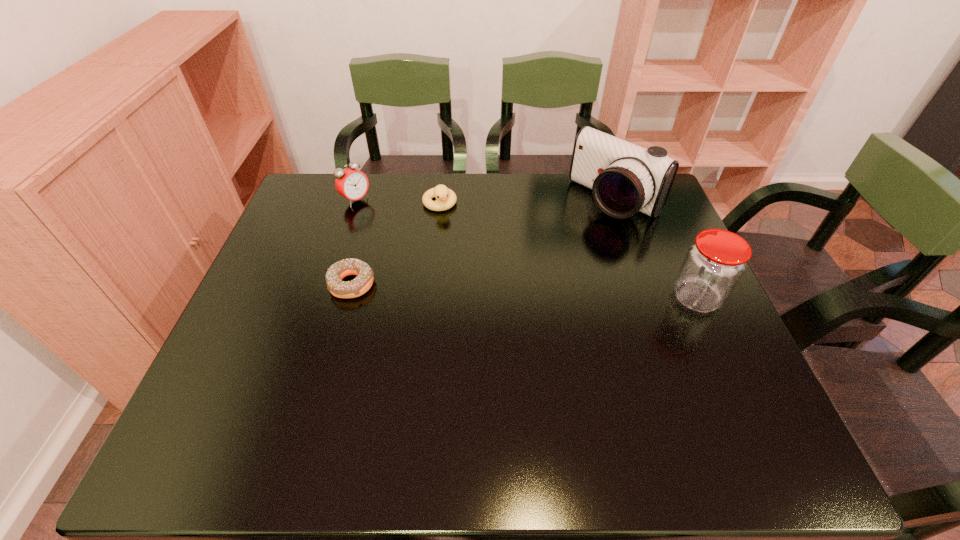
You are a GUI agent. You are given a task and a screenshot of the screen. Output one action in this format:
    pyautogui.click(x=<x>, y=<y>)
    Task: Click on the vacant space that is in between the camcorder and the third object from left to right
    The image size is (960, 540).
    Given the screenshot: What is the action you would take?
    pyautogui.click(x=527, y=202)

You are a GUI agent. You are given a task and a screenshot of the screen. Output one action in this format:
    pyautogui.click(x=<x>, y=<y>)
    Task: Click on the free space that is in between the shortest object and the camcorder
    The image size is (960, 540).
    Given the screenshot: What is the action you would take?
    pyautogui.click(x=483, y=242)

Identify the location of free area in between the shortest object and the jar. Image resolution: width=960 pixels, height=540 pixels. (524, 291).

This screenshot has height=540, width=960. I want to click on empty space that is in between the camcorder and the shortest object, so click(x=483, y=242).

The width and height of the screenshot is (960, 540). In order to click on free space between the jar and the alarm clock in this screenshot , I will do 526,249.

You are a GUI agent. You are given a task and a screenshot of the screen. Output one action in this format:
    pyautogui.click(x=<x>, y=<y>)
    Task: Click on the free space between the camcorder and the doughnut
    
    Given the screenshot: What is the action you would take?
    pyautogui.click(x=483, y=242)

Find the location of `free space between the camcorder and the jar`. free space between the camcorder and the jar is located at coordinates (656, 249).

The height and width of the screenshot is (540, 960). I want to click on vacant area that lies between the doughnut and the third object from right to left, so click(x=396, y=244).

You are a GUI agent. You are given a task and a screenshot of the screen. Output one action in this format:
    pyautogui.click(x=<x>, y=<y>)
    Task: Click on the free space between the shortest object and the camcorder
    Image resolution: width=960 pixels, height=540 pixels.
    Given the screenshot: What is the action you would take?
    pyautogui.click(x=483, y=242)

The image size is (960, 540). What are the coordinates of `vacant space that's between the camcorder and the doughnut` in the screenshot? It's located at (483, 242).